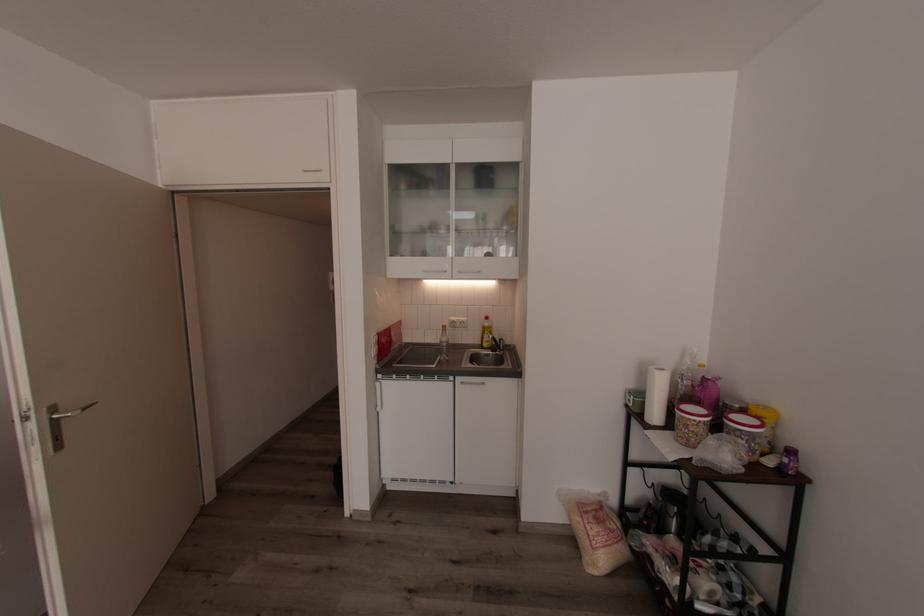
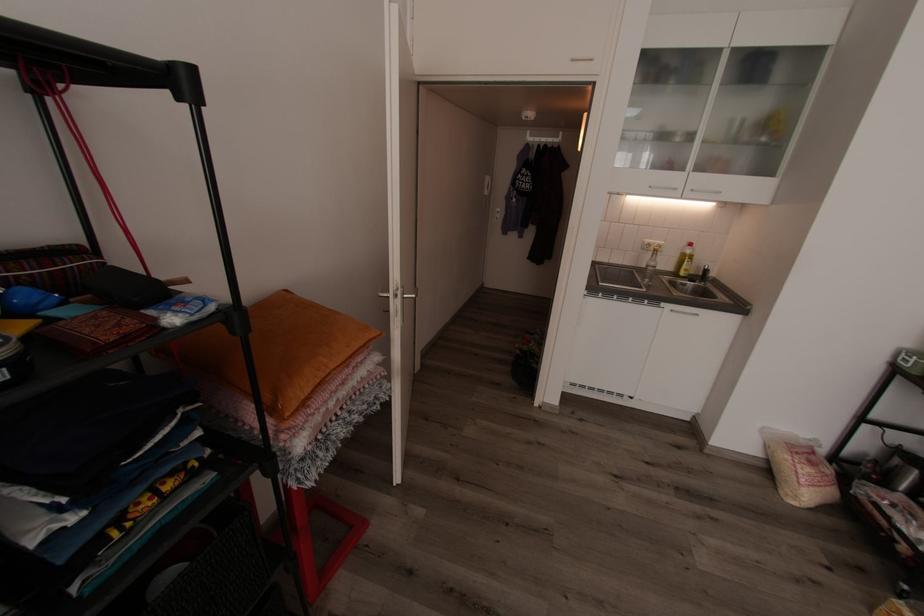
Question: How did the camera likely rotate?

Choices:
 (A) Left
 (B) Right
 (C) Up
 (D) Down

Answer: (D)